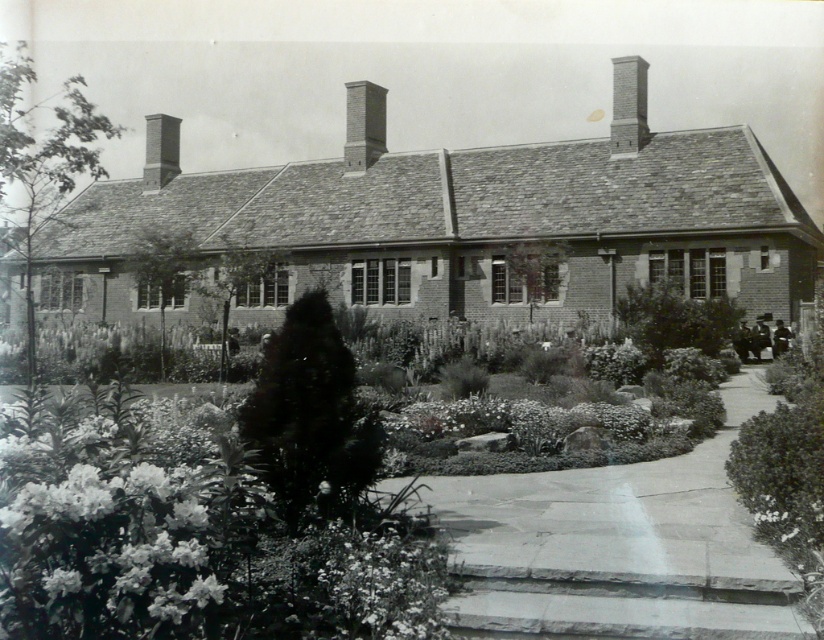
Is fluffy green shrubbery at center positioned before white fluffy flower at lower center?

Yes, fluffy green shrubbery at center is closer to the viewer.

Is point (770, 630) more distant than point (442, 584)?

No.

Is point (370, 461) farther from viewer compared to point (417, 566)?

Yes, point (370, 461) is farther from viewer.

Where is `fluffy green shrubbery at center`? This screenshot has width=824, height=640. fluffy green shrubbery at center is located at coordinates (307, 528).

Is point (640, 83) positioned in front of point (377, 147)?

Yes, it is in front of point (377, 147).

Does smooth brick chimney at upper right appear under smooth brick chimney at center?

No.

Find the location of a particular element. smooth brick chimney at upper right is located at coordinates (628, 106).

Who is higher up, fluffy green shrubbery at center or smooth brick chimney at center?

Positioned higher is smooth brick chimney at center.

Which is behind, point (77, 621) or point (372, 131)?

The point (372, 131) is more distant.

Locate an element on the screen. This screenshot has height=640, width=824. fluffy green shrubbery at center is located at coordinates (307, 528).